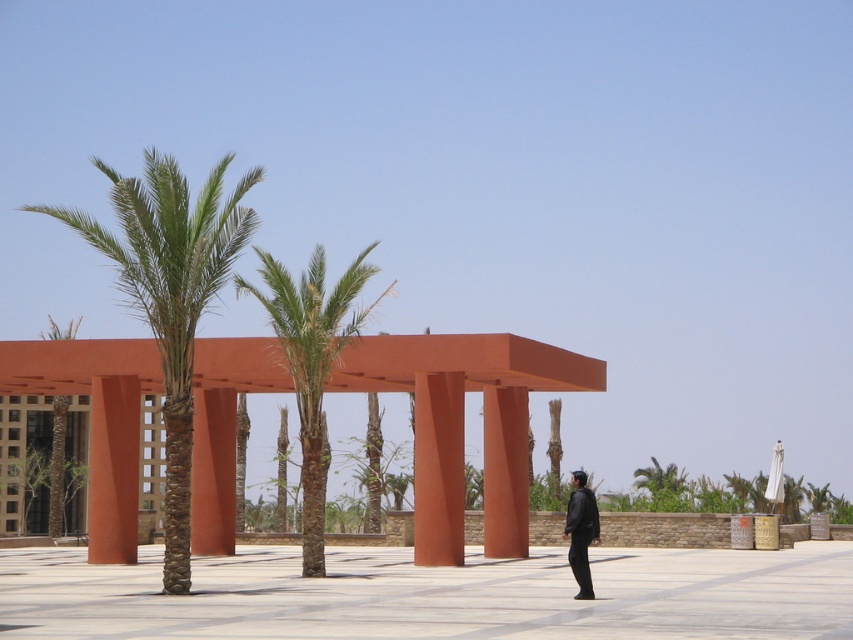
Question: Can you confirm if black leather jacket at lower right is positioned below green leafy palm tree at upper right?

Choices:
 (A) no
 (B) yes

Answer: (A)

Question: Which of the following is the farthest from the observer?

Choices:
 (A) black leather jacket at lower right
 (B) green leafy palm at center

Answer: (B)

Question: Can you confirm if matte orange pergola at center is bigger than black leather jacket at lower right?

Choices:
 (A) yes
 (B) no

Answer: (A)

Question: Which of the following is the farthest from the observer?

Choices:
 (A) green leafy palm at center
 (B) green leafy palm tree at left
 (C) green leafy palm tree at upper right
 (D) green leafy palm tree at center

Answer: (B)

Question: Considering the relative positions of black leather jacket at lower right and green leafy palm tree at left in the image provided, where is black leather jacket at lower right located with respect to green leafy palm tree at left?

Choices:
 (A) above
 (B) below

Answer: (B)

Question: Which point is farther to the camera?

Choices:
 (A) (171, 518)
 (B) (296, 326)

Answer: (B)